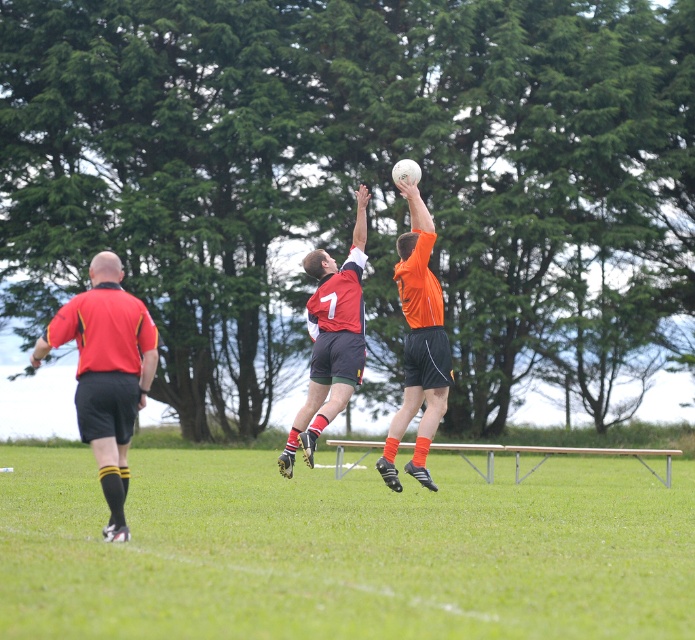
Question: Does red jersey at center have a larger size compared to metallic silver rail at center?

Choices:
 (A) yes
 (B) no

Answer: (B)

Question: Is green grass at center to the left of orange matte jersey at center from the viewer's perspective?

Choices:
 (A) yes
 (B) no

Answer: (A)

Question: Which point is closer to the camera taking this photo?

Choices:
 (A) coord(491,467)
 (B) coord(313,320)

Answer: (B)

Question: Which object is positioned closest to the green grass at center?

Choices:
 (A) matte red shirt at left
 (B) red jersey at center
 (C) orange matte jersey at center
 (D) metallic silver rail at center

Answer: (D)

Question: Does matte red shirt at left lie in front of orange matte jersey at center?

Choices:
 (A) yes
 (B) no

Answer: (A)

Question: Estimate the real-world distances between objects in this image. Which object is closer to the red jersey at center?

Choices:
 (A) matte red shirt at left
 (B) orange matte jersey at center

Answer: (B)